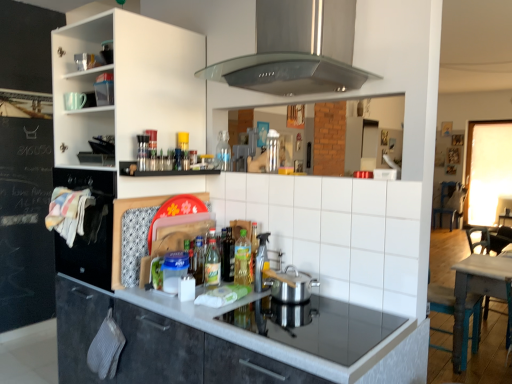
This screenshot has height=384, width=512. Identify the location of free space to the right of translucent plastic bottles at center, which is the third bottle from front to back. (230, 286).